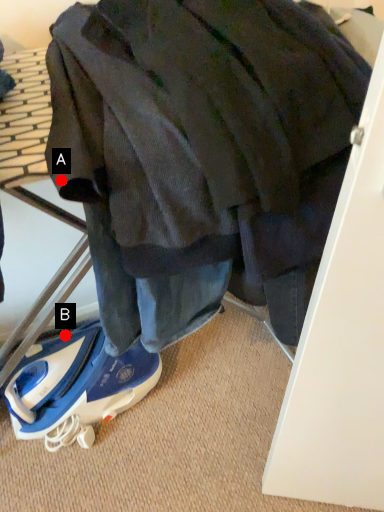
Question: Two points are circled on the image, labeled by A and B beside each circle. Among these points, which one is nearest to the camera?

Choices:
 (A) A is closer
 (B) B is closer

Answer: (A)